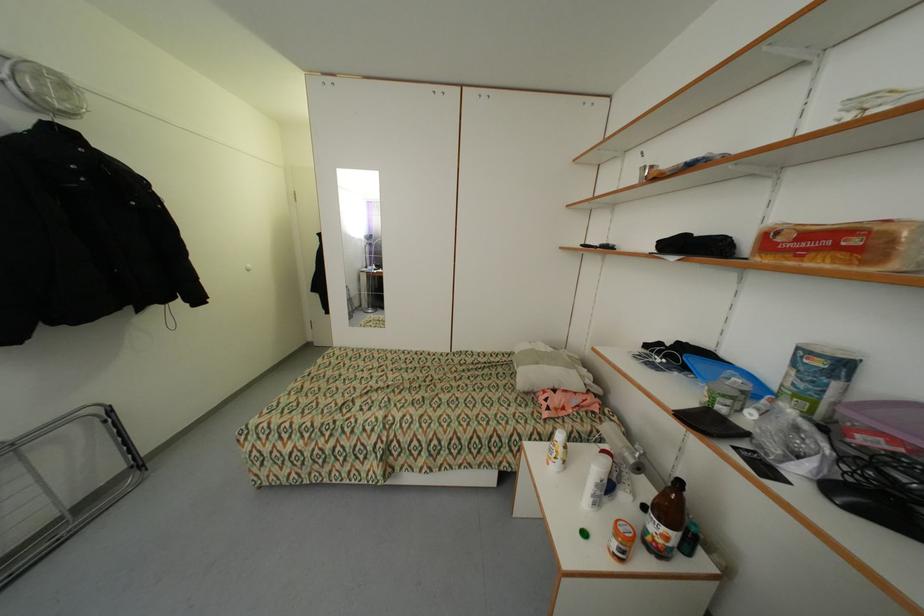
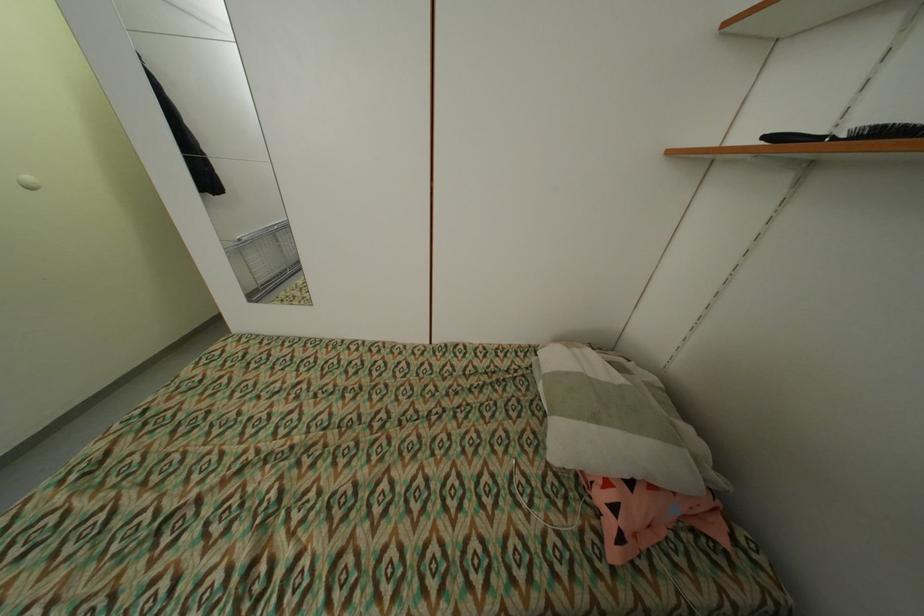
Find the pixel in the second image that matches point 602,248 in the first image.

(841, 140)